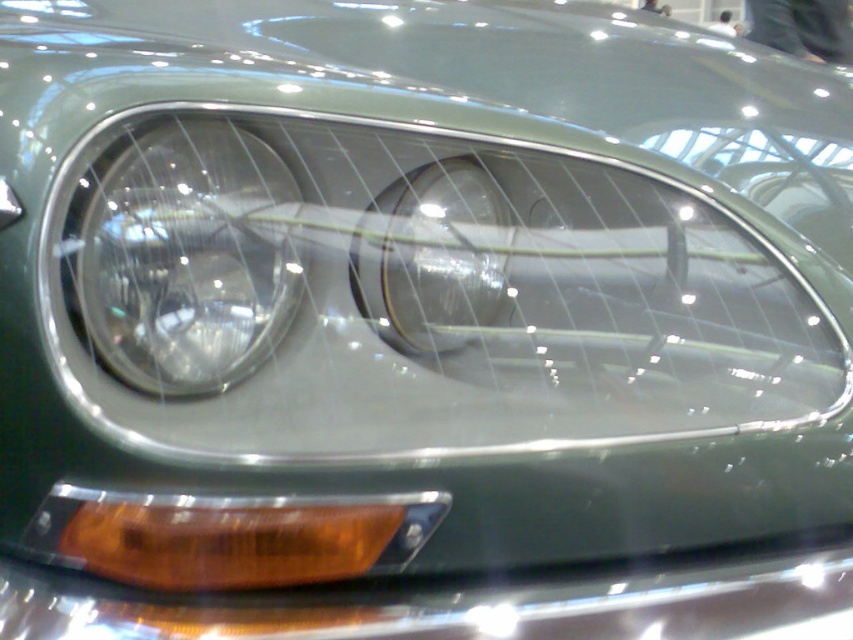
Describe the element at coordinates (184, 257) in the screenshot. The height and width of the screenshot is (640, 853). I see `clear glass headlight at left` at that location.

Find the location of `clear glass headlight at left`. clear glass headlight at left is located at coordinates (184, 257).

At what (x,y) coordinates should I click in order to perform the action: click on clear glass headlight at left. Please return your answer as a coordinate pair (x, y). The image size is (853, 640). Looking at the image, I should click on (184, 257).

What are the coordinates of `clear glass headlight at left` in the screenshot? It's located at (184, 257).

Does clear glass headlight at left have a greater width compared to clear glass headlight at center?

Indeed, clear glass headlight at left has a greater width compared to clear glass headlight at center.

In order to click on clear glass headlight at left in this screenshot , I will do `click(184, 257)`.

Does point (254, 266) come farther from viewer compared to point (390, 289)?

No, (254, 266) is in front of (390, 289).

Where is `clear glass headlight at left`? Image resolution: width=853 pixels, height=640 pixels. clear glass headlight at left is located at coordinates coord(184,257).

Does point (387, 516) come behind point (489, 225)?

No, it is in front of (489, 225).

Find the location of `translucent amber plastic at lower left`. translucent amber plastic at lower left is located at coordinates (231, 536).